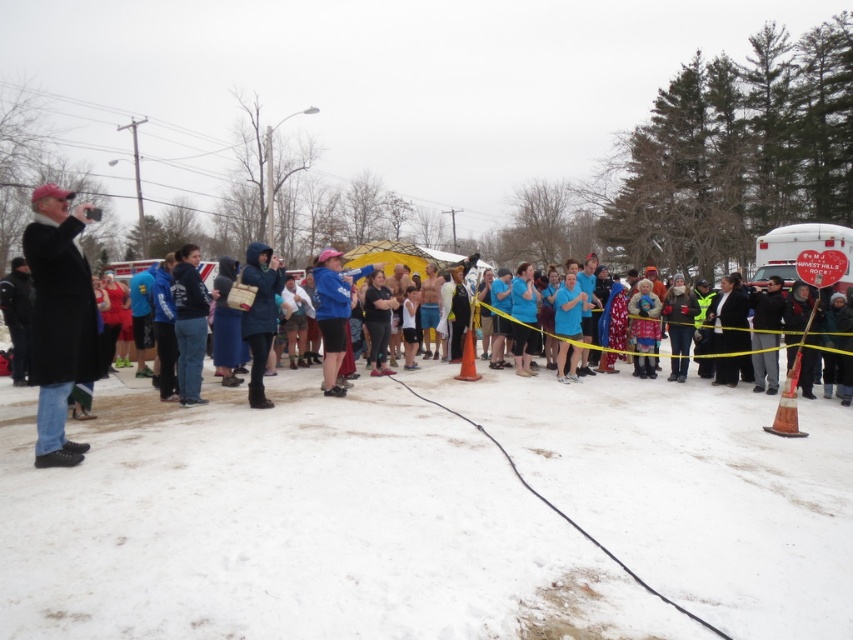
Is dark blue hoodie at center positioned before matte blue coat at center?

No, dark blue hoodie at center is behind matte blue coat at center.

Who is lower down, dark blue hoodie at center or matte blue coat at center?

Positioned lower is matte blue coat at center.

Find the location of a particular element. dark blue hoodie at center is located at coordinates (189, 323).

Is white powdery snow at lower center shorter than black wool coat at left?

Indeed, white powdery snow at lower center has a lesser height compared to black wool coat at left.

Is white powdery snow at lower center wider than black wool coat at left?

Yes.

Which is behind, point (695, 378) or point (38, 355)?

The point (695, 378) is behind.

At what (x,y) coordinates should I click in order to perform the action: click on white powdery snow at lower center. Please return your answer as a coordinate pair (x, y). Looking at the image, I should click on (294, 528).

Does white powdery snow at lower center appear under dark blue hoodie at center?

Yes, white powdery snow at lower center is below dark blue hoodie at center.

Is white powdery snow at lower center positioned behind dark blue hoodie at center?

No, it is not.

Find the location of a particular element. The width and height of the screenshot is (853, 640). white powdery snow at lower center is located at coordinates (294, 528).